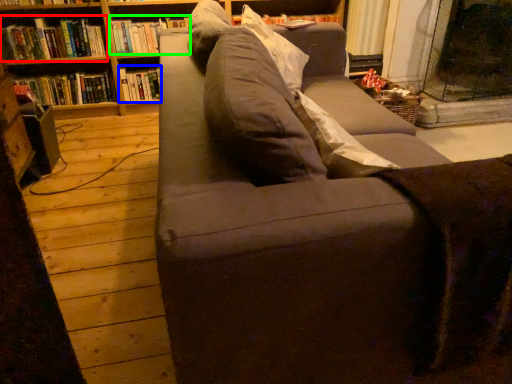
Question: Based on their relative distances, which object is farther from book (highlighted by a red box)? Choose from book (highlighted by a blue box) and book (highlighted by a green box).

Choices:
 (A) book
 (B) book

Answer: (A)